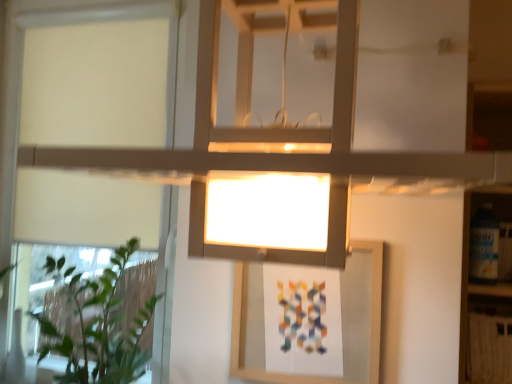
Image resolution: width=512 pixels, height=384 pixels. Describe the element at coordinates (22, 66) in the screenshot. I see `white matte window at upper left` at that location.

Locate an element on the screen. This screenshot has height=384, width=512. white matte window at upper left is located at coordinates (22, 66).

The height and width of the screenshot is (384, 512). I want to click on green leafy plant at left, so click(x=94, y=323).

Describe the element at coordinates (94, 323) in the screenshot. I see `green leafy plant at left` at that location.

Where is `white matte window at upper left`? This screenshot has width=512, height=384. white matte window at upper left is located at coordinates (22, 66).

Between green leafy plant at left and white matte window at upper left, which one appears on the left side from the viewer's perspective?

From the viewer's perspective, white matte window at upper left appears more on the left side.

Which object is more forward, green leafy plant at left or white matte window at upper left?

green leafy plant at left is closer to the camera.

Does point (81, 336) lie in front of point (13, 61)?

Yes, point (81, 336) is closer to viewer.

From the image's perspective, is green leafy plant at left beneath white matte window at upper left?

Indeed, from the image's perspective, green leafy plant at left is shown beneath white matte window at upper left.

From a real-world perspective, who is located higher, green leafy plant at left or white matte window at upper left?

In real-world perspective, white matte window at upper left is above.

Considering the sizes of objects green leafy plant at left and white matte window at upper left in the image provided, who is thinner, green leafy plant at left or white matte window at upper left?

white matte window at upper left.

Which of these two, green leafy plant at left or white matte window at upper left, stands shorter?

green leafy plant at left is shorter.

Is green leafy plant at left bigger than white matte window at upper left?

Yes, green leafy plant at left is bigger than white matte window at upper left.

Do you think green leafy plant at left is within white matte window at upper left, or outside of it?

green leafy plant at left is not inside white matte window at upper left, it's outside.

Is green leafy plant at left touching white matte window at upper left?

No, green leafy plant at left is not beside white matte window at upper left.

Is green leafy plant at left oriented away from white matte window at upper left?

Yes, white matte window at upper left is at the back of green leafy plant at left.

What's the angular difference between green leafy plant at left and white matte window at upper left's facing directions?

green leafy plant at left and white matte window at upper left are facing 0.375 degrees away from each other.

The width and height of the screenshot is (512, 384). I want to click on window above the green leafy plant at left (from a real-world perspective), so click(x=22, y=66).

Between white matte window at upper left and green leafy plant at left, which one appears on the left side from the viewer's perspective?

From the viewer's perspective, white matte window at upper left appears more on the left side.

Considering the relative positions of white matte window at upper left and green leafy plant at left in the image provided, is white matte window at upper left in front of green leafy plant at left?

No, it is not.

Consider the image. Which point is more distant from viewer, (87, 13) or (83, 334)?

Point (87, 13)

From the image's perspective, which is above, white matte window at upper left or green leafy plant at left?

white matte window at upper left.

In the scene shown: From a real-world perspective, which object stands above the other?

white matte window at upper left, from a real-world perspective.

Between white matte window at upper left and green leafy plant at left, which one has larger width?

With larger width is green leafy plant at left.

Does white matte window at upper left have a lesser height compared to green leafy plant at left?

In fact, white matte window at upper left may be taller than green leafy plant at left.

Based on their sizes in the image, would you say white matte window at upper left is bigger or smaller than green leafy plant at left?

Considering their sizes, white matte window at upper left takes up less space than green leafy plant at left.

Could green leafy plant at left be considered to be inside white matte window at upper left?

No, green leafy plant at left is located outside of white matte window at upper left.

Is white matte window at upper left next to green leafy plant at left?

There is a gap between white matte window at upper left and green leafy plant at left.

Is white matte window at upper left turned away from green leafy plant at left?

Absolutely, white matte window at upper left is directed away from green leafy plant at left.

This screenshot has height=384, width=512. What are the coordinates of `window above the green leafy plant at left (from the image's perspective)` in the screenshot? It's located at (22, 66).

Identify the location of window behind the green leafy plant at left. Image resolution: width=512 pixels, height=384 pixels. (22, 66).

Where is `houseplant on the right of the white matte window at upper left`? The image size is (512, 384). houseplant on the right of the white matte window at upper left is located at coordinates (94, 323).